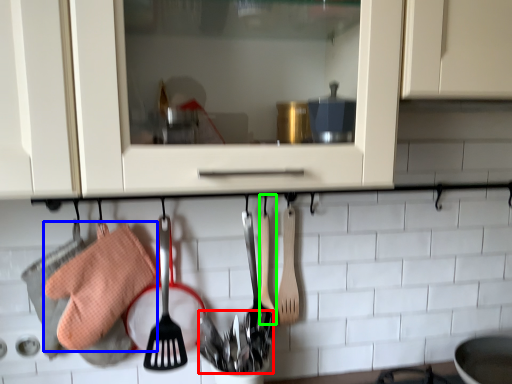
Question: Considering the real-world distances, which object is farthest from silverware (highlighted by a red box)? material (highlighted by a blue box) or spatula (highlighted by a green box)?

Choices:
 (A) material
 (B) spatula

Answer: (A)